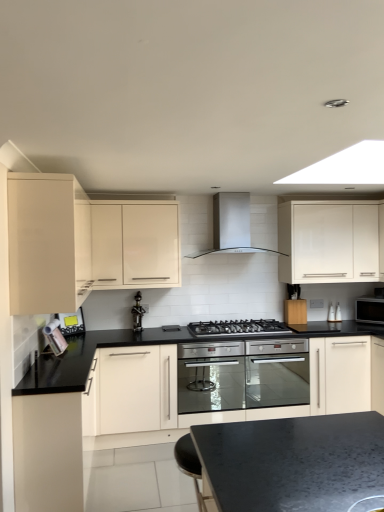
Question: From the image's perspective, is black matte gas stove at center beneath black glass microwave at right, which is counted as the first appliance, starting from the right?

Choices:
 (A) no
 (B) yes

Answer: (B)

Question: Considering the relative sizes of black matte gas stove at center and black glass microwave at right, the third appliance in the left-to-right sequence, in the image provided, is black matte gas stove at center wider than black glass microwave at right, the third appliance in the left-to-right sequence,?

Choices:
 (A) yes
 (B) no

Answer: (A)

Question: Would you consider black matte gas stove at center to be distant from black glass microwave at right, the third appliance in the left-to-right sequence?

Choices:
 (A) no
 (B) yes

Answer: (B)

Question: Could you tell me if black matte gas stove at center is turned towards black glass microwave at right, the 1th appliance when ordered from back to front?

Choices:
 (A) yes
 (B) no

Answer: (B)

Question: From a real-world perspective, is black matte gas stove at center located beneath black glass microwave at right, which is counted as the first appliance, starting from the right?

Choices:
 (A) yes
 (B) no

Answer: (A)

Question: From the image's perspective, is white glossy cabinet at upper right, the 3th cabinetry when ordered from left to right, above or below black glass microwave at right, the 1th appliance when ordered from back to front?

Choices:
 (A) below
 (B) above

Answer: (B)

Question: Considering the positions of white glossy cabinet at upper right, the first cabinetry positioned from the right, and black glass microwave at right, which appears as the 3th appliance when viewed from the front, in the image, is white glossy cabinet at upper right, the first cabinetry positioned from the right, taller or shorter than black glass microwave at right, which appears as the 3th appliance when viewed from the front,?

Choices:
 (A) tall
 (B) short

Answer: (A)

Question: Is white glossy cabinet at upper right, the 3th cabinetry when ordered from left to right, wider or thinner than black glass microwave at right, which appears as the 3th appliance when viewed from the front?

Choices:
 (A) thin
 (B) wide

Answer: (B)

Question: From a real-world perspective, relative to black glass microwave at right, which appears as the 3th appliance when viewed from the front, is white glossy cabinet at upper right, the 3th cabinetry when ordered from left to right, vertically above or below?

Choices:
 (A) above
 (B) below

Answer: (A)

Question: Is matte cream cabinet at left, the third cabinetry viewed from the right, wider or thinner than satin silver range hood at center?

Choices:
 (A) thin
 (B) wide

Answer: (A)

Question: Relative to satin silver range hood at center, is matte cream cabinet at left, the first cabinetry when ordered from left to right, in front or behind?

Choices:
 (A) front
 (B) behind

Answer: (A)

Question: Considering the relative positions of matte cream cabinet at left, the first cabinetry when ordered from left to right, and satin silver range hood at center in the image provided, is matte cream cabinet at left, the first cabinetry when ordered from left to right, to the left or to the right of satin silver range hood at center?

Choices:
 (A) right
 (B) left

Answer: (B)

Question: From the image's perspective, relative to satin silver range hood at center, is matte cream cabinet at left, the third cabinetry viewed from the right, above or below?

Choices:
 (A) below
 (B) above

Answer: (A)

Question: From the image's perspective, is white glossy cabinet at upper center, acting as the 2th cabinetry starting from the left, positioned above or below white glossy cabinet at upper right, the 3th cabinetry when ordered from left to right?

Choices:
 (A) above
 (B) below

Answer: (B)

Question: Is point (135, 224) positioned closer to the camera than point (367, 251)?

Choices:
 (A) closer
 (B) farther

Answer: (A)